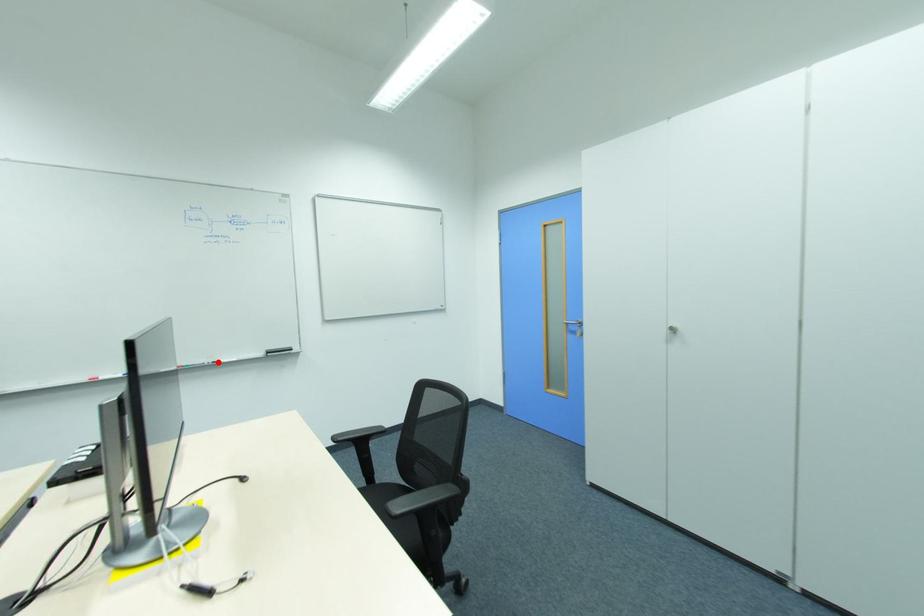
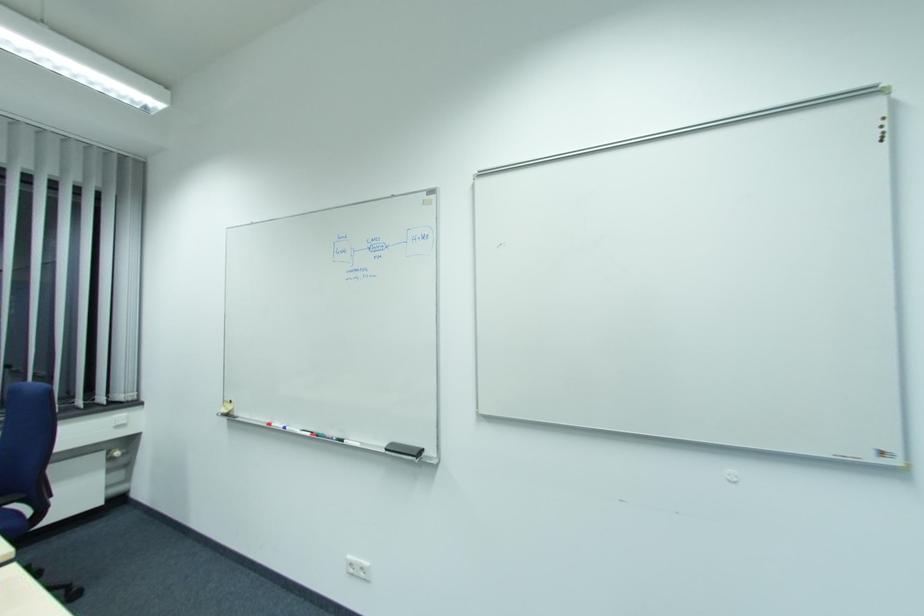
Locate, in the second image, the point that corresponds to the highlighted location in the first image.

(344, 440)